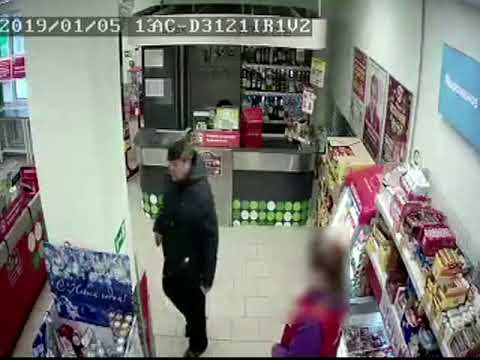
At what (x,y) coordinates should I click in order to perform the action: click on wall poster. Please return your answer as a coordinate pair (x, y). Looking at the image, I should click on (396, 123), (372, 101), (356, 84), (455, 92).